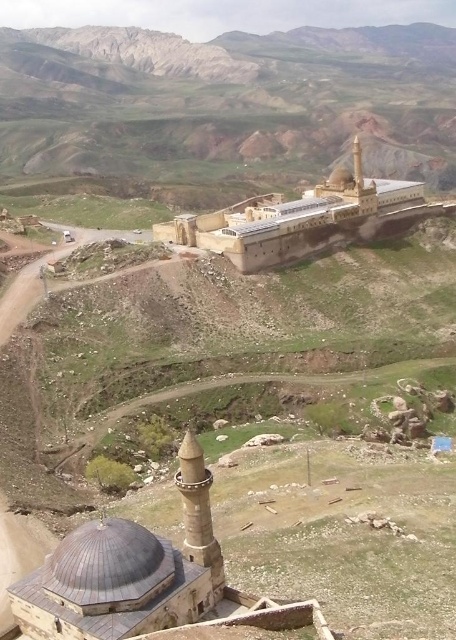
Question: Does brown rocky mountain at upper center have a larger size compared to beige stone building at center?

Choices:
 (A) no
 (B) yes

Answer: (B)

Question: Which of the following is the farthest from the observer?

Choices:
 (A) (200, 234)
 (B) (165, 113)

Answer: (B)

Question: In this image, where is brown rocky mountain at upper center located relative to beige stone building at center?

Choices:
 (A) above
 (B) below

Answer: (A)

Question: Among these objects, which one is nearest to the camera?

Choices:
 (A) beige stone building at center
 (B) brown rocky mountain at upper center

Answer: (A)

Question: Can you confirm if brown rocky mountain at upper center is positioned above beige stone building at center?

Choices:
 (A) no
 (B) yes

Answer: (B)